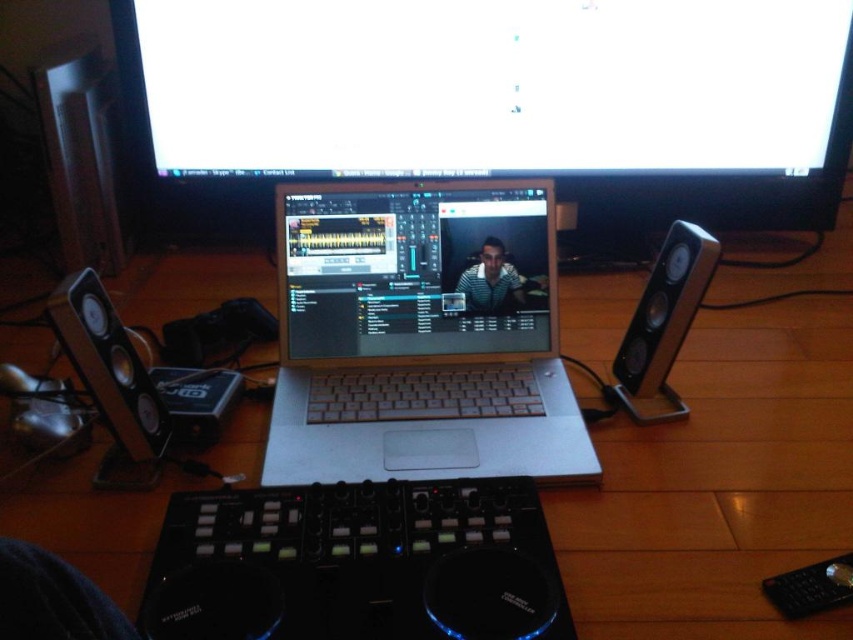
Question: Which point is closer to the camera?

Choices:
 (A) white plastic keyboard at center
 (B) satin black laptop at center
 (C) silver metallic speaker at right
 (D) matte black monitor at upper center

Answer: (C)

Question: Observing the image, what is the correct spatial positioning of silver metallic laptop at center in reference to matte black laptop at center?

Choices:
 (A) right
 (B) left

Answer: (B)

Question: Which of the following is the farthest from the observer?

Choices:
 (A) (413, 186)
 (B) (646, 552)

Answer: (A)

Question: Is white plastic keyboard at center bigger than black plastic speaker at left?

Choices:
 (A) no
 (B) yes

Answer: (A)

Question: Among these points, which one is farthest from the camera?

Choices:
 (A) (479, 154)
 (B) (662, 406)
 (C) (821, 512)

Answer: (A)

Question: Is white plastic keyboard at center closer to camera compared to black plastic speaker at left?

Choices:
 (A) no
 (B) yes

Answer: (A)